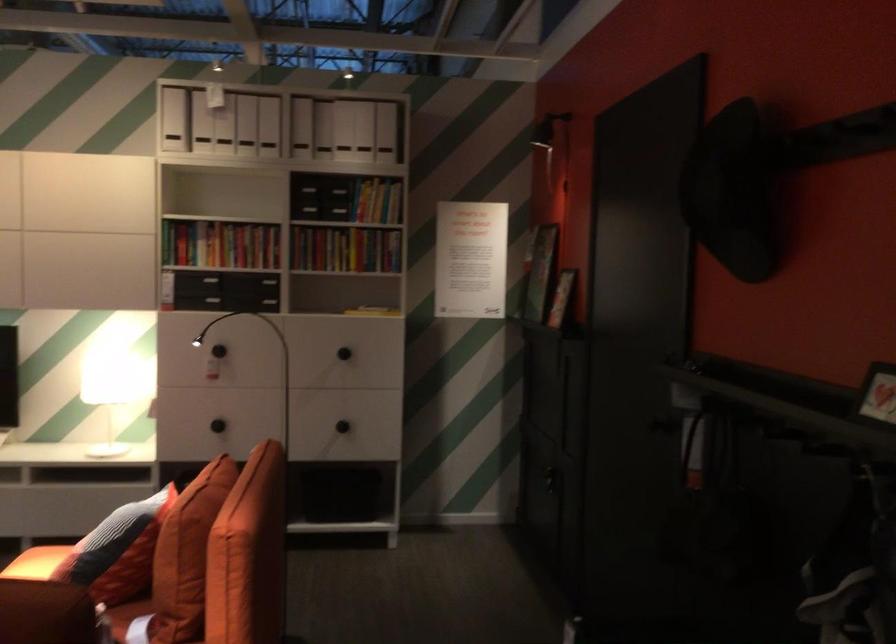
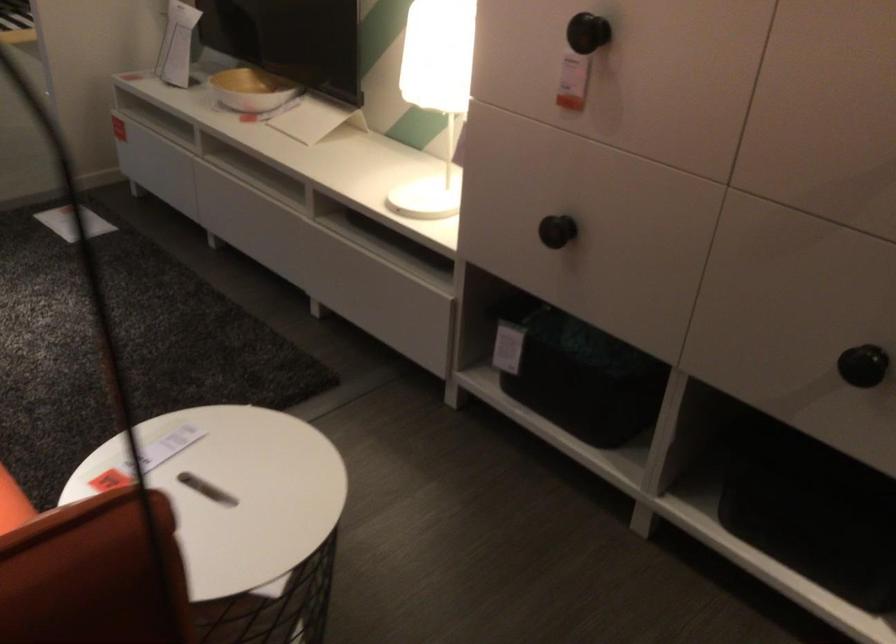
In the second image, find the point that corresponds to pixel 110 393 in the first image.

(435, 93)